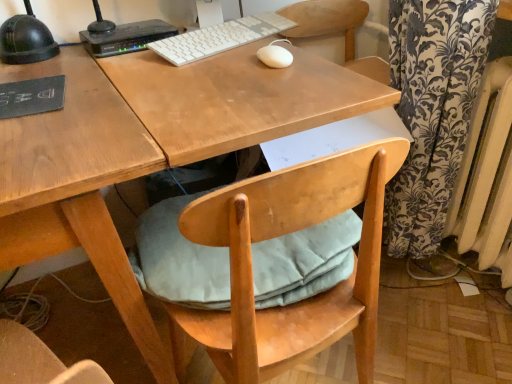
At what (x,y) coordinates should I click in order to perform the action: click on space that is in front of white plastic keyboard at upper center. Please return your answer as a coordinate pair (x, y). Looking at the image, I should click on (218, 76).